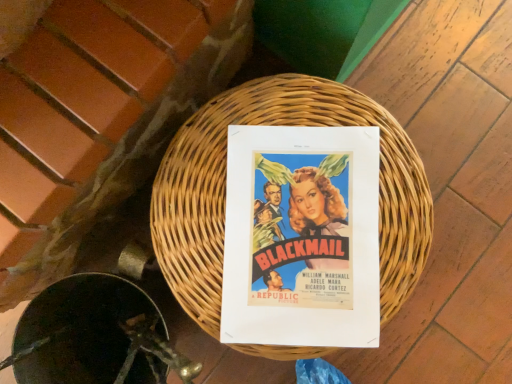
Measure the distance between point (277,287) and camera.

Point (277,287) is 57.60 centimeters away from camera.

The width and height of the screenshot is (512, 384). Find the location of `matte paper poster at center`. matte paper poster at center is located at coordinates (301, 237).

The width and height of the screenshot is (512, 384). Describe the element at coordinates (301, 237) in the screenshot. I see `matte paper poster at center` at that location.

What are the coordinates of `matte paper poster at center` in the screenshot? It's located at (301, 237).